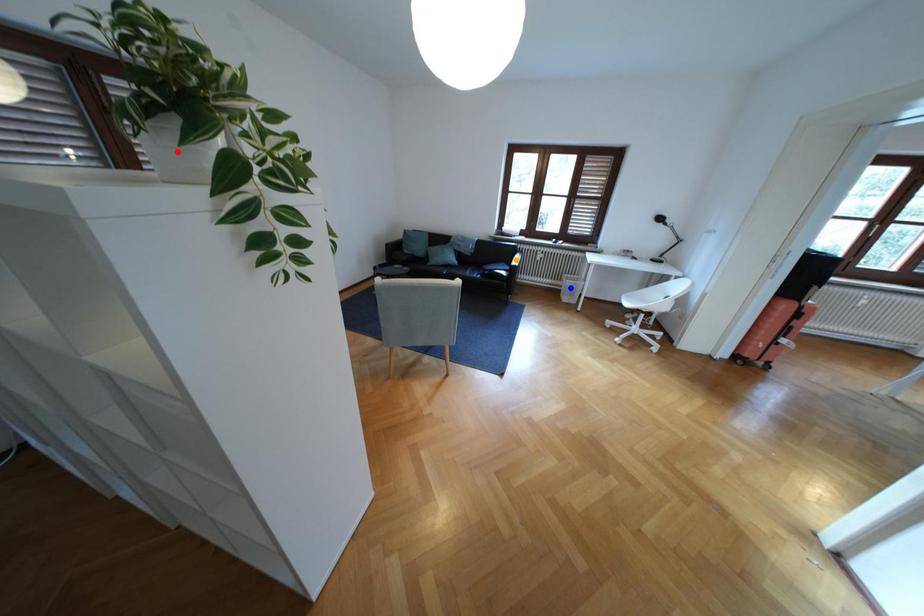
Order these from nearest to farthest:
A) orange point
B) red point
C) blue point

blue point < orange point < red point